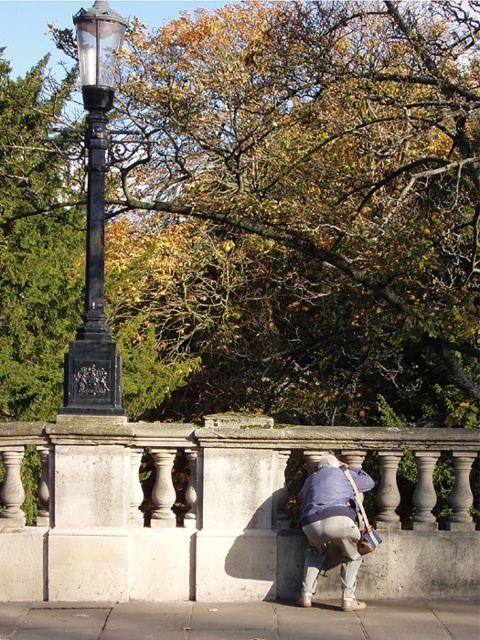
Between black wrought iron lamp post at left and light blue fabric at lower center, which one has more height?

light blue fabric at lower center

Is point (99, 147) farther from viewer compared to point (354, 477)?

That is True.

Between point (90, 65) and point (327, 484), which one is positioned behind?

The point (90, 65) is more distant.

The image size is (480, 640). I want to click on black wrought iron lamp post at left, so click(95, 220).

Does white stone balustrade at center have a smaller size compared to black wrought iron lamp post at left?

Incorrect, white stone balustrade at center is not smaller in size than black wrought iron lamp post at left.

What do you see at coordinates (216, 509) in the screenshot? I see `white stone balustrade at center` at bounding box center [216, 509].

I want to click on white stone balustrade at center, so click(216, 509).

Can you confirm if white stone balustrade at center is positioned to the left of light blue fabric at lower center?

Yes, white stone balustrade at center is to the left of light blue fabric at lower center.

Is point (99, 508) behind point (346, 490)?

Yes, it is.

Does point (273, 552) come in front of point (345, 518)?

No, it is not.

At what (x,y) coordinates should I click in order to perform the action: click on white stone balustrade at center. Please return your answer as a coordinate pair (x, y). This screenshot has height=640, width=480. Looking at the image, I should click on (216, 509).